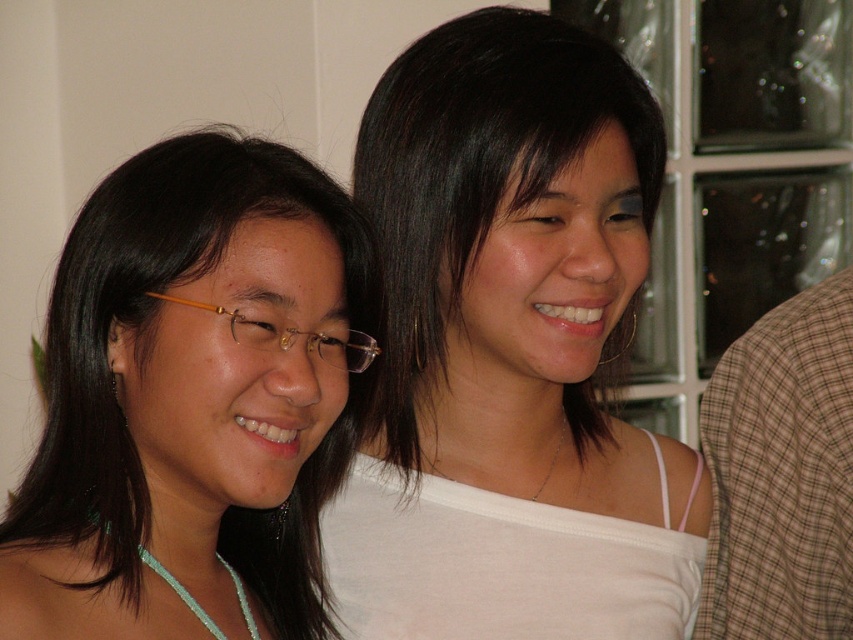
Does white matte tank top at center appear on the right side of matte gold glasses at left?

Correct, you'll find white matte tank top at center to the right of matte gold glasses at left.

Looking at this image, between white matte tank top at center and matte gold glasses at left, which one appears on the left side from the viewer's perspective?

Positioned to the left is matte gold glasses at left.

Between point (448, 440) and point (341, 211), which one is positioned behind?

The point (448, 440) is behind.

In order to click on white matte tank top at center in this screenshot , I will do `click(511, 352)`.

Can you confirm if matte gold glasses at left is thinner than brown plaid shirt at right?

Incorrect, matte gold glasses at left's width is not less than brown plaid shirt at right's.

Does matte gold glasses at left have a smaller size compared to brown plaid shirt at right?

Actually, matte gold glasses at left might be larger than brown plaid shirt at right.

Does point (318, 566) come closer to viewer compared to point (759, 332)?

Yes.

The width and height of the screenshot is (853, 640). I want to click on matte gold glasses at left, so click(x=193, y=401).

Who is more forward, (x=532, y=113) or (x=799, y=529)?

Point (x=532, y=113) is in front.

Which of these two, white matte tank top at center or brown plaid shirt at right, stands shorter?

brown plaid shirt at right is shorter.

Where is `white matte tank top at center`? This screenshot has height=640, width=853. white matte tank top at center is located at coordinates (511, 352).

You are a GUI agent. You are given a task and a screenshot of the screen. Output one action in this format:
    pyautogui.click(x=<x>, y=<y>)
    Task: Click on the white matte tank top at center
    
    Given the screenshot: What is the action you would take?
    pyautogui.click(x=511, y=352)